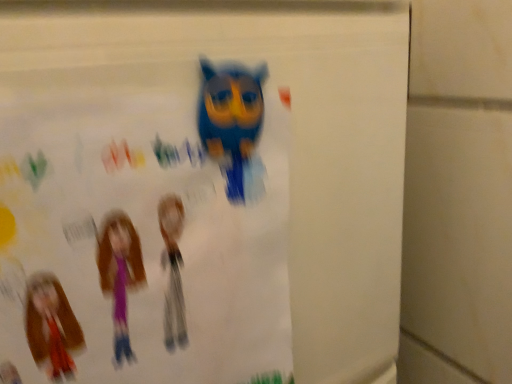
Question: Would you say blue matte owl at upper center is inside or outside matte paper poster at upper center?

Choices:
 (A) outside
 (B) inside

Answer: (B)

Question: Is point (249, 96) positioned closer to the camera than point (9, 319)?

Choices:
 (A) closer
 (B) farther

Answer: (B)

Question: From the image's perspective, is blue matte owl at upper center located above or below matte paper poster at upper center?

Choices:
 (A) below
 (B) above

Answer: (B)

Question: Is matte paper poster at upper center in front of or behind blue matte owl at upper center in the image?

Choices:
 (A) behind
 (B) front

Answer: (B)

Question: Considering the positions of matte paper poster at upper center and blue matte owl at upper center in the image, is matte paper poster at upper center bigger or smaller than blue matte owl at upper center?

Choices:
 (A) small
 (B) big

Answer: (B)

Question: Do you think matte paper poster at upper center is within blue matte owl at upper center, or outside of it?

Choices:
 (A) outside
 (B) inside

Answer: (A)

Question: Considering the positions of matte paper poster at upper center and blue matte owl at upper center in the image, is matte paper poster at upper center wider or thinner than blue matte owl at upper center?

Choices:
 (A) wide
 (B) thin

Answer: (A)